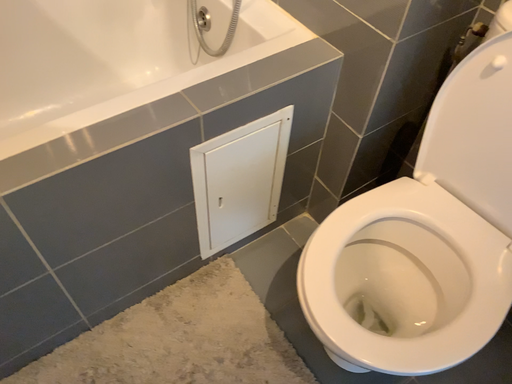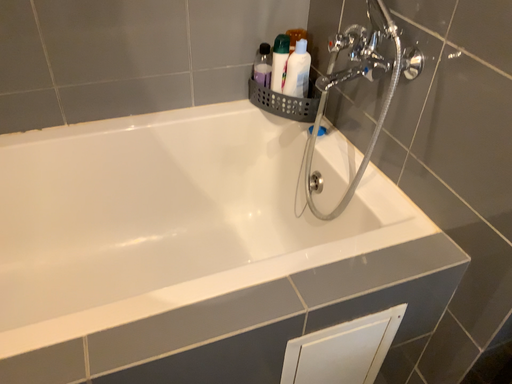
Question: Which way did the camera rotate in the video?

Choices:
 (A) rotated downward
 (B) rotated upward

Answer: (B)